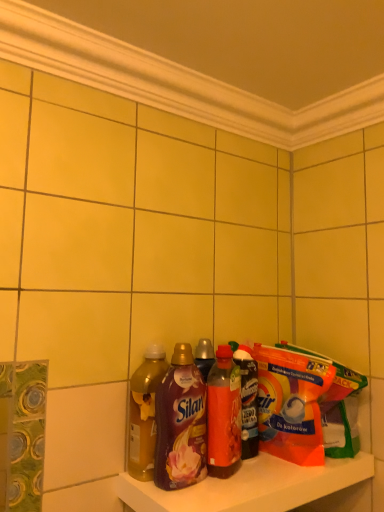
Question: Considering the relative positions of translucent plastic bottles at lower center and translucent plastic bottle at center, placed as the 4th bottle when sorted from left to right, in the image provided, is translucent plastic bottles at lower center to the right of translucent plastic bottle at center, placed as the 4th bottle when sorted from left to right, from the viewer's perspective?

Choices:
 (A) yes
 (B) no

Answer: (A)

Question: From the image's perspective, is translucent plastic bottles at lower center beneath translucent plastic bottle at center, positioned as the 1th bottle in right-to-left order?

Choices:
 (A) no
 (B) yes

Answer: (B)

Question: Does translucent plastic bottles at lower center have a smaller size compared to translucent plastic bottle at center, placed as the 4th bottle when sorted from left to right?

Choices:
 (A) no
 (B) yes

Answer: (A)

Question: Considering the relative positions of translucent plastic bottles at lower center and translucent plastic bottle at center, positioned as the 1th bottle in right-to-left order, in the image provided, is translucent plastic bottles at lower center behind translucent plastic bottle at center, positioned as the 1th bottle in right-to-left order,?

Choices:
 (A) yes
 (B) no

Answer: (B)

Question: Is translucent plastic bottles at lower center wider than translucent plastic bottle at center, placed as the 4th bottle when sorted from left to right?

Choices:
 (A) no
 (B) yes

Answer: (B)

Question: In the image, is orange plastic bag at shelf right positioned in front of or behind translucent amber liquid at shelf center, which is the fourth bottle from right to left?

Choices:
 (A) front
 (B) behind

Answer: (B)

Question: Is point (329, 381) positioned closer to the camera than point (155, 386)?

Choices:
 (A) closer
 (B) farther

Answer: (B)

Question: Considering the positions of orange plastic bag at shelf right and translucent amber liquid at shelf center, which is the fourth bottle from right to left, in the image, is orange plastic bag at shelf right bigger or smaller than translucent amber liquid at shelf center, which is the fourth bottle from right to left,?

Choices:
 (A) big
 (B) small

Answer: (A)

Question: From their relative heights in the image, would you say orange plastic bag at shelf right is taller or shorter than translucent amber liquid at shelf center, placed as the first bottle when sorted from left to right?

Choices:
 (A) short
 (B) tall

Answer: (A)

Question: From a real-world perspective, is orange plastic bag at shelf right above or below translucent plastic bottle at center, which ranks as the 3th bottle in left-to-right order?

Choices:
 (A) below
 (B) above

Answer: (A)

Question: In terms of width, does orange plastic bag at shelf right look wider or thinner when compared to translucent plastic bottle at center, the second bottle viewed from the right?

Choices:
 (A) thin
 (B) wide

Answer: (B)

Question: In the image, is orange plastic bag at shelf right on the left side or the right side of translucent plastic bottle at center, the second bottle viewed from the right?

Choices:
 (A) right
 (B) left

Answer: (A)

Question: Do you think orange plastic bag at shelf right is within translucent plastic bottle at center, the second bottle viewed from the right, or outside of it?

Choices:
 (A) outside
 (B) inside

Answer: (A)

Question: From the image's perspective, relative to orange plastic bag at shelf right, is translucent plastic bottles at lower center above or below?

Choices:
 (A) above
 (B) below

Answer: (B)

Question: Which is correct: translucent plastic bottles at lower center is inside orange plastic bag at shelf right, or outside of it?

Choices:
 (A) outside
 (B) inside

Answer: (A)